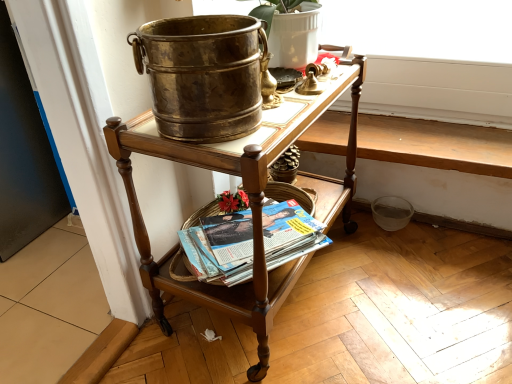
Find the location of `vacant area that is situated to the right of polished wood desk at center`. vacant area that is situated to the right of polished wood desk at center is located at coordinates (411, 292).